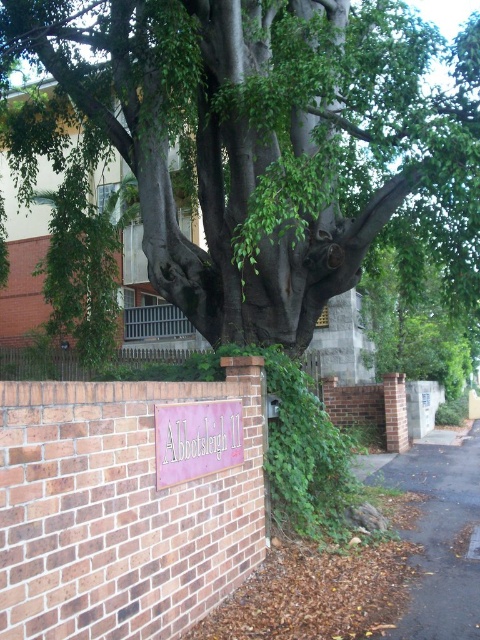
Can you confirm if green rough bark tree at center is positioned to the left of pink matte sign at center?

In fact, green rough bark tree at center is to the right of pink matte sign at center.

Can you confirm if green rough bark tree at center is taller than pink matte sign at center?

Yes, green rough bark tree at center is taller than pink matte sign at center.

Is point (307, 296) positioned before point (206, 404)?

No.

In order to click on green rough bark tree at center in this screenshot , I will do `click(259, 141)`.